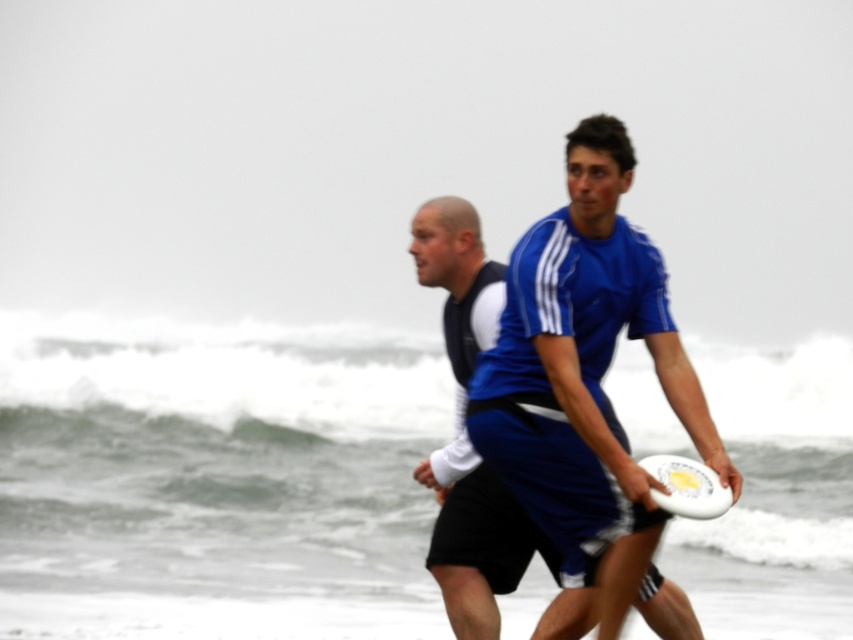
Question: Which of these objects is positioned closest to the white foamy wave at center?

Choices:
 (A) blue fabric shirt at center
 (B) white plastic frisbee at center

Answer: (A)

Question: Is blue fabric shirt at center further to camera compared to white plastic frisbee at center?

Choices:
 (A) no
 (B) yes

Answer: (B)

Question: Based on their relative distances, which object is nearer to the white plastic frisbee at center?

Choices:
 (A) white foamy wave at center
 (B) blue fabric shirt at center

Answer: (B)

Question: Does white foamy wave at center have a larger size compared to white plastic frisbee at center?

Choices:
 (A) yes
 (B) no

Answer: (A)

Question: Does white foamy wave at center come behind blue fabric shirt at center?

Choices:
 (A) yes
 (B) no

Answer: (B)

Question: Which point is farther to the camera?

Choices:
 (A) white plastic frisbee at center
 (B) white foamy wave at center

Answer: (B)